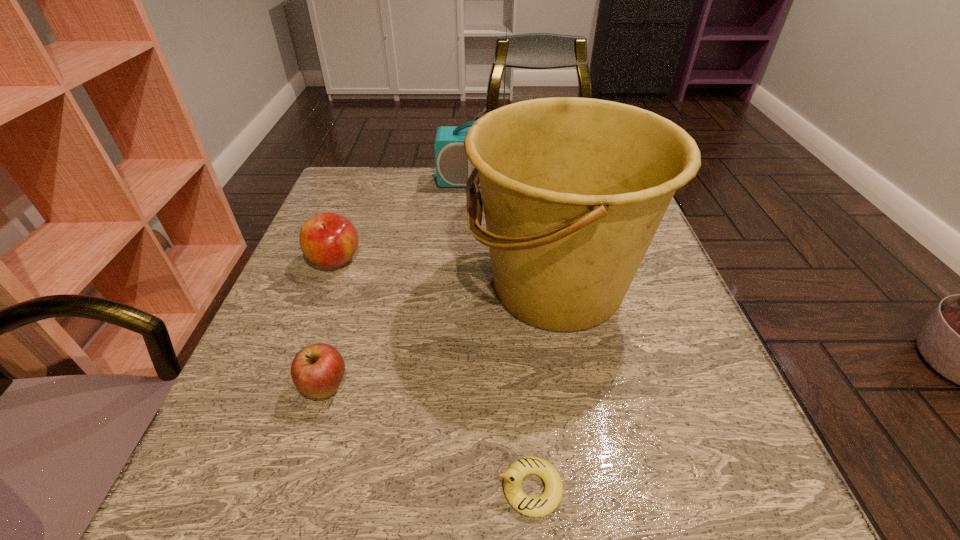
At what (x,y) coordinates should I click in order to perform the action: click on the farthest object. Please return your answer as a coordinate pair (x, y). This screenshot has width=960, height=540. Looking at the image, I should click on (453, 168).

This screenshot has width=960, height=540. I want to click on the second tallest object, so click(x=574, y=189).

Where is `the farther apple`? the farther apple is located at coordinates (329, 240).

This screenshot has height=540, width=960. Identify the location of the second nearest object. (x=317, y=370).

At what (x,y) coordinates should I click in order to perform the action: click on the shortest object. Please return your answer as a coordinate pair (x, y). The height and width of the screenshot is (540, 960). Looking at the image, I should click on (540, 506).

This screenshot has width=960, height=540. I want to click on the nearest object, so click(540, 506).

At what (x,y) coordinates should I click in order to perform the action: click on vacant space situated 0.360m on the front panel of the farthest object. Please return your answer as a coordinate pair (x, y). Looking at the image, I should click on (486, 285).

This screenshot has height=540, width=960. I want to click on vacant space situated 0.220m on the side of the fourth shortest object with the handle, so click(357, 288).

Where is `vacant space located on the side of the fourth shortest object with the handle`? This screenshot has height=540, width=960. vacant space located on the side of the fourth shortest object with the handle is located at coordinates (377, 288).

At what (x,y) coordinates should I click in order to perform the action: click on vacant space situated 0.080m on the side of the fourth shortest object with the handle. Please return your answer as a coordinate pair (x, y). The height and width of the screenshot is (540, 960). Looking at the image, I should click on (427, 288).